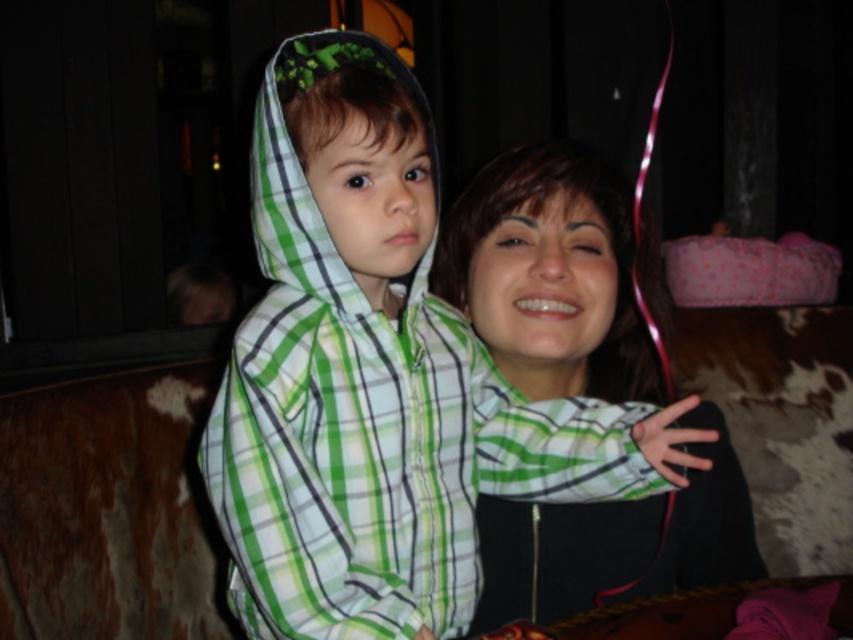
You are a photographer setting up for a family portrait. You notice two green plaid items in the scene. The green plaid hoodie at center and the matte green plaid shirt at center. Which one is positioned to the left?

The green plaid hoodie at center is positioned to the left of the matte green plaid shirt at center.

You are a photographer adjusting the lighting for a closeup shot of both the green plaid hoodie at center and the matte green plaid shirt at center. The minimum distance required between the two items for the lighting setup to work properly is 10 inches. Based on the scene, will the current spacing between them allow the lighting setup to function correctly?

The green plaid hoodie at center is 8.51 inches from the matte green plaid shirt at center. Since the required minimum distance is 10 inches, the current spacing is insufficient for the lighting setup to function properly.

From the picture: You are a photographer trying to capture the perfect shot of the scene. You notice a point at coordinates (378, 387) in the image. Which object in the scene does this point most likely represent?

The point at coordinates (378, 387) corresponds to the green plaid hoodie at center.